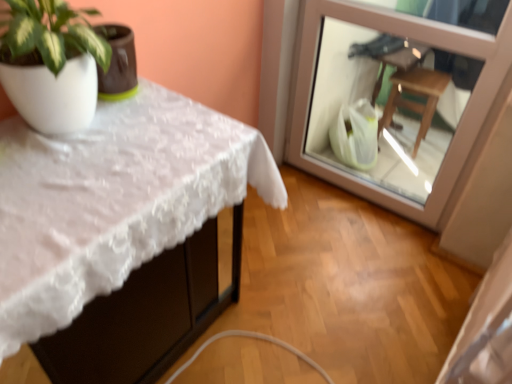
Question: Considering the relative positions of transparent glass door at upper right and white lace tablecloth at upper left in the image provided, is transparent glass door at upper right behind white lace tablecloth at upper left?

Choices:
 (A) yes
 (B) no

Answer: (A)

Question: Does transparent glass door at upper right have a lesser height compared to white lace tablecloth at upper left?

Choices:
 (A) no
 (B) yes

Answer: (A)

Question: Is transparent glass door at upper right bigger than white lace tablecloth at upper left?

Choices:
 (A) no
 (B) yes

Answer: (A)

Question: Is transparent glass door at upper right surrounding white lace tablecloth at upper left?

Choices:
 (A) yes
 (B) no

Answer: (B)

Question: Is transparent glass door at upper right oriented away from white lace tablecloth at upper left?

Choices:
 (A) no
 (B) yes

Answer: (A)

Question: Is transparent glass door at upper right wider than white lace tablecloth at upper left?

Choices:
 (A) no
 (B) yes

Answer: (A)

Question: Can you confirm if white lace tablecloth at upper left is taller than transparent glass door at upper right?

Choices:
 (A) no
 (B) yes

Answer: (A)

Question: Is white lace tablecloth at upper left positioned far away from transparent glass door at upper right?

Choices:
 (A) no
 (B) yes

Answer: (B)

Question: Does white lace tablecloth at upper left come behind transparent glass door at upper right?

Choices:
 (A) yes
 (B) no

Answer: (B)

Question: Does white lace tablecloth at upper left have a larger size compared to transparent glass door at upper right?

Choices:
 (A) yes
 (B) no

Answer: (A)

Question: Is white lace tablecloth at upper left looking in the opposite direction of transparent glass door at upper right?

Choices:
 (A) yes
 (B) no

Answer: (B)

Question: From a real-world perspective, is white lace tablecloth at upper left physically above transparent glass door at upper right?

Choices:
 (A) yes
 (B) no

Answer: (B)

Question: In the image, is transparent glass door at upper right positioned in front of or behind white lace tablecloth at upper left?

Choices:
 (A) behind
 (B) front

Answer: (A)